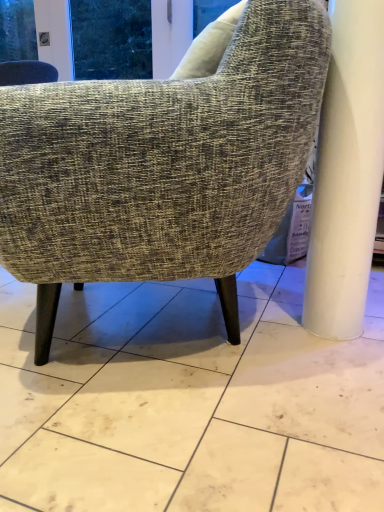
Question: Is white marble floor at center next to textured gray fabric chair at center and touching it?

Choices:
 (A) yes
 (B) no

Answer: (B)

Question: Can you confirm if white marble floor at center is wider than textured gray fabric chair at center?

Choices:
 (A) yes
 (B) no

Answer: (A)

Question: From the image's perspective, is white marble floor at center over textured gray fabric chair at center?

Choices:
 (A) no
 (B) yes

Answer: (A)

Question: Does white marble floor at center lie behind textured gray fabric chair at center?

Choices:
 (A) no
 (B) yes

Answer: (A)

Question: Are white marble floor at center and textured gray fabric chair at center located far from each other?

Choices:
 (A) no
 (B) yes

Answer: (A)

Question: Would you say textured gray fabric chair at center is part of white marble floor at center's contents?

Choices:
 (A) no
 (B) yes

Answer: (A)

Question: Can you see textured gray fabric chair at center touching white marble floor at center?

Choices:
 (A) yes
 (B) no

Answer: (B)

Question: Is textured gray fabric chair at center facing towards white marble floor at center?

Choices:
 (A) no
 (B) yes

Answer: (A)

Question: Is textured gray fabric chair at center not close to white marble floor at center?

Choices:
 (A) no
 (B) yes

Answer: (A)

Question: Does textured gray fabric chair at center have a greater width compared to white marble floor at center?

Choices:
 (A) no
 (B) yes

Answer: (A)

Question: Is textured gray fabric chair at center to the left of white marble floor at center from the viewer's perspective?

Choices:
 (A) no
 (B) yes

Answer: (A)

Question: Can you confirm if textured gray fabric chair at center is positioned to the right of white marble floor at center?

Choices:
 (A) no
 (B) yes

Answer: (B)

Question: From a real-world perspective, relative to textured gray fabric chair at center, is white marble floor at center vertically above or below?

Choices:
 (A) above
 (B) below

Answer: (B)